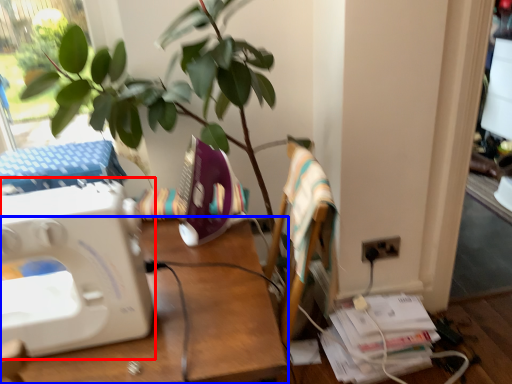
Question: Among these objects, which one is farthest to the camera, sewing machine (highlighted by a red box) or desk (highlighted by a blue box)?

Choices:
 (A) sewing machine
 (B) desk

Answer: (A)